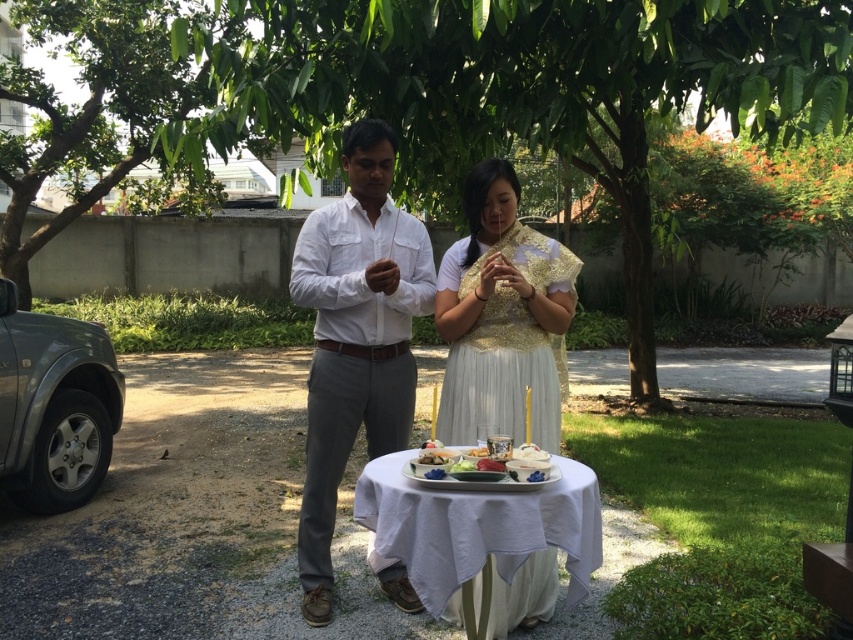
You are a photographer setting up for a ceremony. You have a gold embroidered blouse at center and a smooth white plate at center in the scene. You want to ensure both items are in focus. The camera you are using has a depth of field that can cover 20 inches. Will both items be in focus?

The gold embroidered blouse at center and smooth white plate at center are 21.84 inches apart. Since the camera can only cover 20 inches, the distance between them exceeds the depth of field coverage. Therefore, both items cannot be in focus simultaneously.

Based on the photo, you are a photographer trying to capture the gold embroidered blouse at center and the smooth white plate at center in a single shot. Which object should you adjust your camera to focus on first if you want to ensure both are in frame?

The gold embroidered blouse at center is positioned on the right side of smooth white plate at center, so you should focus on the smooth white plate at center first to ensure both objects are within the frame.